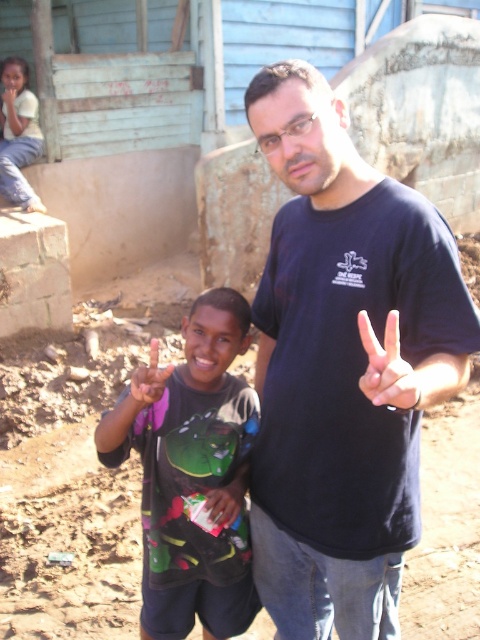
Question: Which object is positioned farthest from the dark gray t-shirt at center?

Choices:
 (A) dark blue t-shirt at center
 (B) matte black hand at center
 (C) smooth skin hand at center
 (D) pink fabric at center

Answer: (B)

Question: Is dark blue t-shirt at center above dark gray t-shirt at center?

Choices:
 (A) yes
 (B) no

Answer: (A)

Question: Which object is positioned closest to the matte black hand at center?

Choices:
 (A) smooth skin hand at center
 (B) dark blue t-shirt at center
 (C) pink fabric at center
 (D) dark gray t-shirt at center

Answer: (B)

Question: Can you confirm if matte black hand at center is positioned above pink fabric at center?

Choices:
 (A) yes
 (B) no

Answer: (A)

Question: Does matte black hand at center appear on the left side of pink fabric at center?

Choices:
 (A) yes
 (B) no

Answer: (B)

Question: Which object is positioned farthest from the matte black hand at center?

Choices:
 (A) dark gray t-shirt at center
 (B) pink fabric at center
 (C) dark blue t-shirt at center
 (D) smooth skin hand at center

Answer: (D)